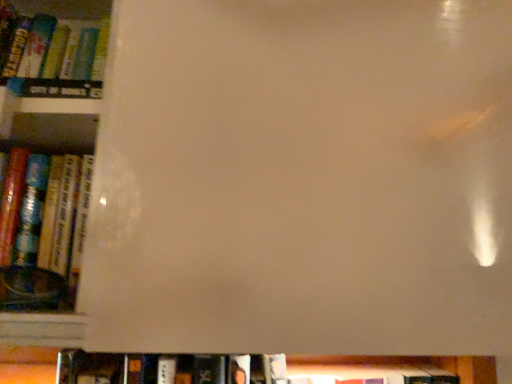
Question: Is hardcover book at lower center, the first book viewed from the back, further to camera compared to hardcover book at left, the 2th book from the back?

Choices:
 (A) yes
 (B) no

Answer: (A)

Question: From the image's perspective, is hardcover book at lower center, which appears as the 2th book when viewed from the front, above hardcover book at left, acting as the first book starting from the front?

Choices:
 (A) yes
 (B) no

Answer: (B)

Question: From a real-world perspective, is hardcover book at lower center, the first book viewed from the back, physically below hardcover book at left, which is the first book in top-to-bottom order?

Choices:
 (A) yes
 (B) no

Answer: (A)

Question: Can you confirm if hardcover book at lower center, the 2th book positioned from the top, is positioned to the right of hardcover book at left, acting as the 2th book starting from the bottom?

Choices:
 (A) yes
 (B) no

Answer: (A)

Question: From the image's perspective, is hardcover book at lower center, which appears as the 2th book when viewed from the front, beneath hardcover book at left, which is the first book in top-to-bottom order?

Choices:
 (A) no
 (B) yes

Answer: (B)

Question: Is hardcover book at lower center, the 1th book in the bottom-to-top sequence, not near hardcover book at left, the 2th book from the back?

Choices:
 (A) no
 (B) yes

Answer: (A)

Question: Is hardcover book at left, acting as the first book starting from the front, wider than hardcover book at lower center, the 1th book in the bottom-to-top sequence?

Choices:
 (A) yes
 (B) no

Answer: (B)

Question: Considering the relative sizes of hardcover book at left, acting as the 2th book starting from the bottom, and hardcover book at lower center, the first book viewed from the back, in the image provided, is hardcover book at left, acting as the 2th book starting from the bottom, taller than hardcover book at lower center, the first book viewed from the back,?

Choices:
 (A) no
 (B) yes

Answer: (B)

Question: Is there a large distance between hardcover book at left, acting as the first book starting from the front, and hardcover book at lower center, the first book viewed from the back?

Choices:
 (A) no
 (B) yes

Answer: (A)

Question: From the image's perspective, is hardcover book at left, which is the first book in top-to-bottom order, on hardcover book at lower center, the first book viewed from the back?

Choices:
 (A) yes
 (B) no

Answer: (A)

Question: From the image's perspective, is hardcover book at left, which is the first book in top-to-bottom order, under hardcover book at lower center, the first book viewed from the back?

Choices:
 (A) yes
 (B) no

Answer: (B)

Question: Is hardcover book at left, acting as the first book starting from the front, next to hardcover book at lower center, the first book viewed from the back, and touching it?

Choices:
 (A) no
 (B) yes

Answer: (A)

Question: Does point (267, 362) appear closer or farther from the camera than point (56, 266)?

Choices:
 (A) closer
 (B) farther

Answer: (B)